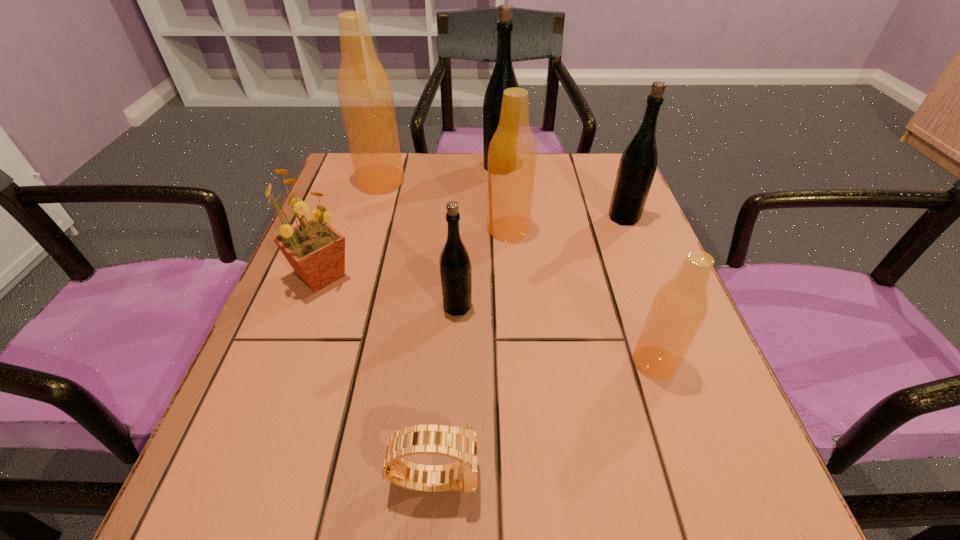
The image size is (960, 540). Identify the location of free space located 0.330m on the back of the nearest green beer bottle. (463, 196).

Identify the location of vacant point located 0.370m on the left of the nearest beer bottle. The image size is (960, 540). (404, 362).

Identify the location of blank area located on the face of the shortest object. This screenshot has height=540, width=960. (704, 477).

The width and height of the screenshot is (960, 540). What are the coordinates of `object that is at the near edge` in the screenshot? It's located at (461, 444).

In order to click on beer bottle that is at the left edge in this screenshot , I will do `click(364, 90)`.

The height and width of the screenshot is (540, 960). Identify the location of sunflower present at the left edge. (316, 251).

The image size is (960, 540). Find the location of `object that is at the far left corner`. object that is at the far left corner is located at coordinates (364, 90).

I want to click on free region at the far edge of the desktop, so click(x=468, y=177).

This screenshot has width=960, height=540. What are the coordinates of `vacant position at the left edge of the desktop` in the screenshot? It's located at (372, 216).

The image size is (960, 540). Find the location of `blank space at the right edge of the desktop`. blank space at the right edge of the desktop is located at coordinates (648, 230).